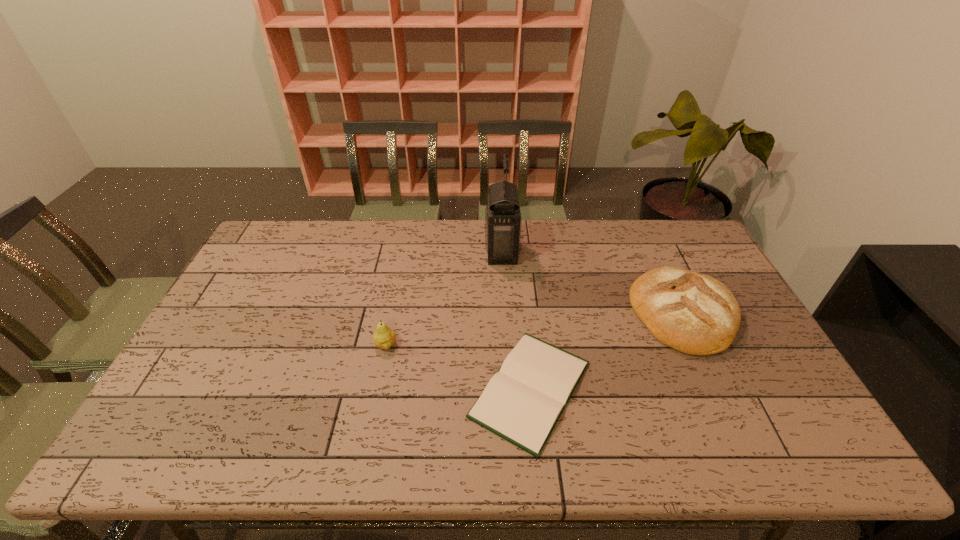
Image resolution: width=960 pixels, height=540 pixels. In order to click on the farthest object in this screenshot , I will do `click(503, 221)`.

Identify the location of lantern. pos(503,221).

Where is `the leftmost object`? Image resolution: width=960 pixels, height=540 pixels. the leftmost object is located at coordinates click(x=384, y=337).

I want to click on the rightmost object, so click(x=691, y=312).

In order to click on the shortest object in this screenshot , I will do [522, 403].

The width and height of the screenshot is (960, 540). I want to click on free space located on the front-facing side of the tallest object, so click(x=414, y=252).

Find the location of a particular element. The width and height of the screenshot is (960, 540). free space located 0.390m on the front-facing side of the tallest object is located at coordinates (373, 252).

Identify the location of free spot located 0.340m on the front-facing side of the tallest object. (388, 252).

You are a GUI agent. You are given a task and a screenshot of the screen. Output one action in this format:
    pyautogui.click(x=<x>, y=<y>)
    Task: Click on the vacant space located on the back of the leftmost object
    The width and height of the screenshot is (960, 540).
    Given the screenshot: What is the action you would take?
    pyautogui.click(x=394, y=303)

Identify the location of vacant position located on the front of the rightmost object. This screenshot has width=960, height=540. (743, 441).